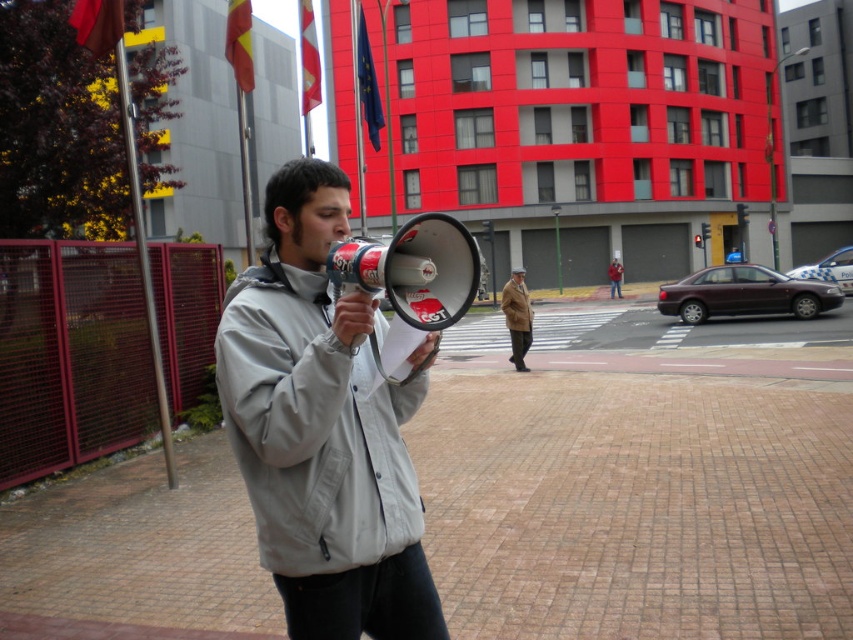
Question: Among these objects, which one is farthest from the camera?

Choices:
 (A) brown wool coat at center
 (B) light gray fabric jacket at center

Answer: (A)

Question: Which point is closer to the camera taking this photo?

Choices:
 (A) (325, 600)
 (B) (532, 314)

Answer: (A)

Question: Observing the image, what is the correct spatial positioning of light gray fabric jacket at center in reference to brown wool coat at center?

Choices:
 (A) right
 (B) left

Answer: (B)

Question: Is the position of light gray fabric jacket at center less distant than that of brown wool coat at center?

Choices:
 (A) yes
 (B) no

Answer: (A)

Question: Is light gray fabric jacket at center positioned behind brown wool coat at center?

Choices:
 (A) no
 (B) yes

Answer: (A)